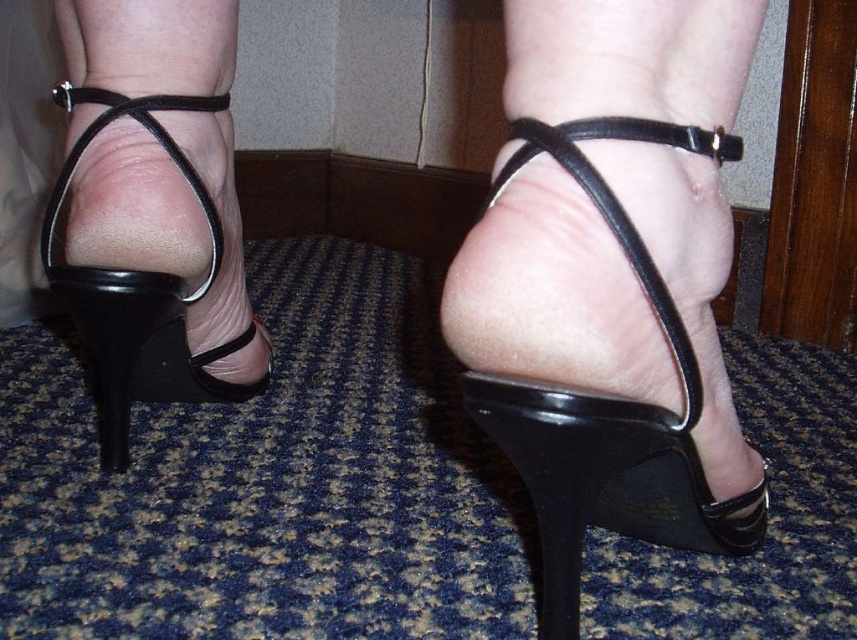
Is point (572, 534) positioned in front of point (175, 384)?

Yes, it is.

Is black shiny sandal at center taller than black leather sandal at left?

In fact, black shiny sandal at center may be shorter than black leather sandal at left.

Identify the location of black shiny sandal at center. The image size is (857, 640). (610, 404).